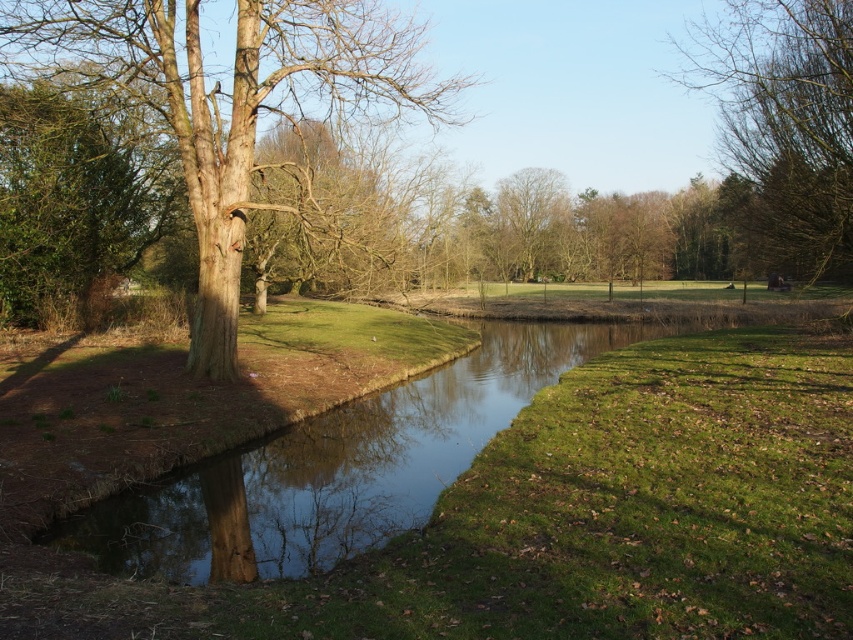
Which of these two, clear water at center or bare brown tree at center, stands shorter?

Standing shorter between the two is clear water at center.

Can you confirm if clear water at center is positioned below bare brown tree at center?

Yes, clear water at center is below bare brown tree at center.

Measure the distance between point (375, 426) and camera.

The distance of point (375, 426) from camera is 15.38 meters.

Locate an element on the screen. Image resolution: width=853 pixels, height=640 pixels. clear water at center is located at coordinates (339, 467).

Which is above, bare wood tree at upper right or bare brown tree at center?

bare wood tree at upper right is higher up.

Is bare wood tree at upper right above bare brown tree at center?

Yes.

Who is more forward, (834, 68) or (567, 200)?

Positioned in front is point (834, 68).

I want to click on bare wood tree at upper right, so [782, 129].

Does bare wood tree at upper right come behind green leafy tree at left?

That is False.

Does bare wood tree at upper right appear under green leafy tree at left?

No.

The width and height of the screenshot is (853, 640). I want to click on bare wood tree at upper right, so click(782, 129).